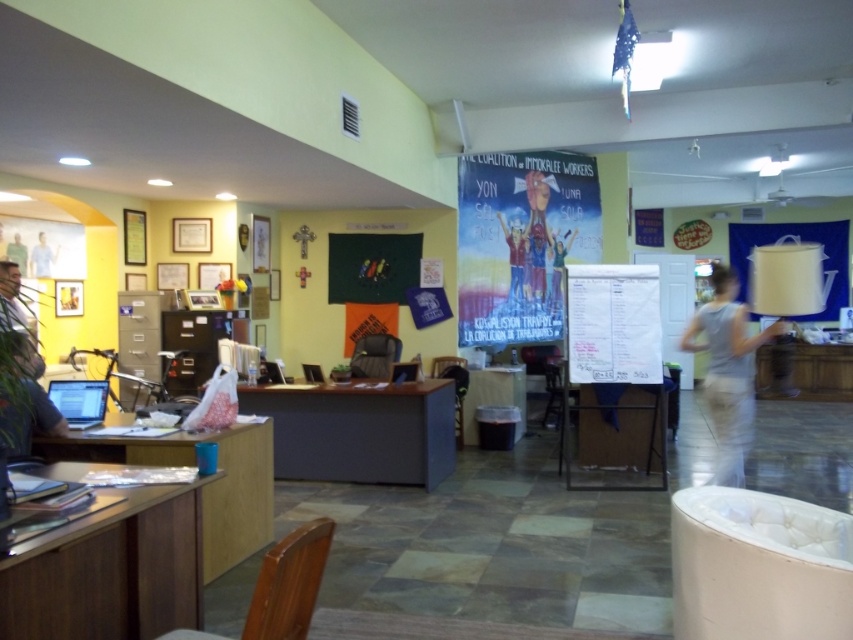
Question: Among these points, which one is farthest from the camera?

Choices:
 (A) (167, 529)
 (B) (517, 401)
 (C) (561, 259)
 (D) (33, 269)

Answer: (C)

Question: Which point is closer to the camera?

Choices:
 (A) rainbow-colored fabric at center
 (B) wooden desk at lower left
 (C) light blue shirt at left
 (D) brown wood table at lower left

Answer: (D)

Question: Can you confirm if matte black bulletin board at center is wider than matte plastic table at center?

Choices:
 (A) yes
 (B) no

Answer: (A)

Question: Is white fabric dress at right thinner than matte plastic table at center?

Choices:
 (A) no
 (B) yes

Answer: (B)

Question: From the image, what is the correct spatial relationship of matte black bulletin board at center in relation to rainbow-colored fabric at center?

Choices:
 (A) right
 (B) left

Answer: (B)

Question: Which point is closer to the camera taking this photo?

Choices:
 (A) [123, 616]
 (B) [517, 234]

Answer: (A)